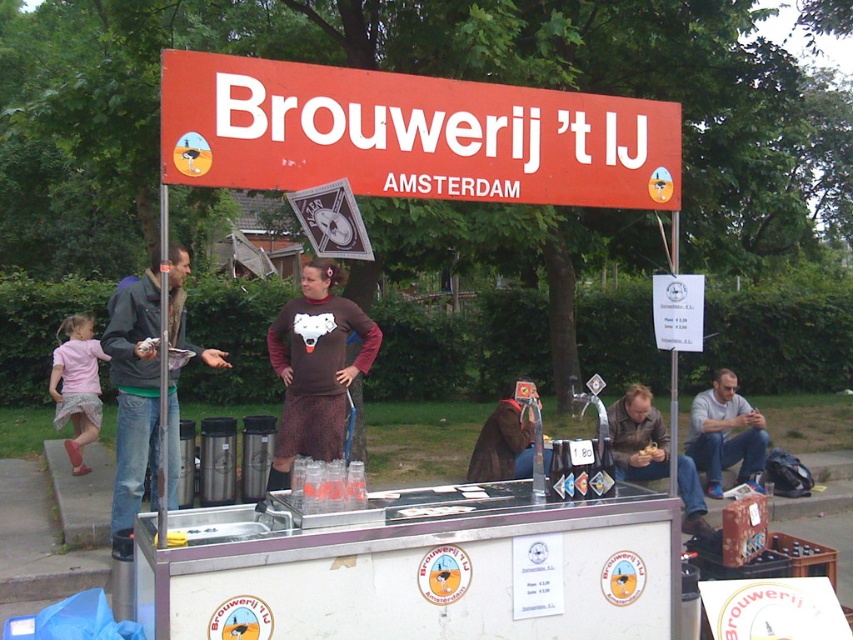
Question: Which of the following is the farthest from the observer?

Choices:
 (A) gray fabric shirt at lower right
 (B) red plastic sign at upper center
 (C) metallic silver food truck at center
 (D) jeans jacket at left

Answer: (A)

Question: Which object is positioned farthest from the brown cotton sweater at center?

Choices:
 (A) red plastic sign at upper center
 (B) brown leather jacket at lower right
 (C) metallic silver food truck at center
 (D) gray fabric shirt at lower right

Answer: (D)

Question: Is brown cotton sweater at center behind gray fabric shirt at lower right?

Choices:
 (A) yes
 (B) no

Answer: (B)

Question: Which point is closer to the camera taking this photo?

Choices:
 (A) (181, 68)
 (B) (759, 451)

Answer: (A)

Question: From the image, what is the correct spatial relationship of gray fabric shirt at lower right in relation to brown leather jacket at lower right?

Choices:
 (A) below
 (B) above

Answer: (B)

Question: Does jeans jacket at left appear on the left side of gray fabric shirt at lower right?

Choices:
 (A) yes
 (B) no

Answer: (A)